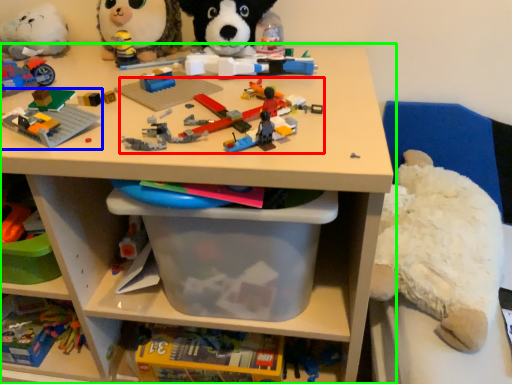
Question: Which object is positioned farthest from toy (highlighted by a red box)? Select from toy (highlighted by a blue box) and shelf (highlighted by a green box).

Choices:
 (A) toy
 (B) shelf

Answer: (B)